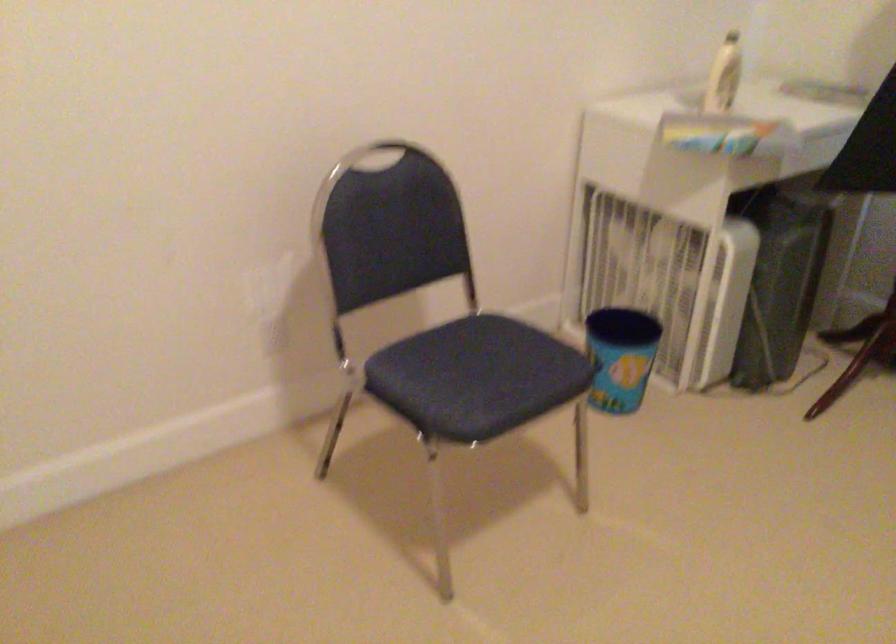
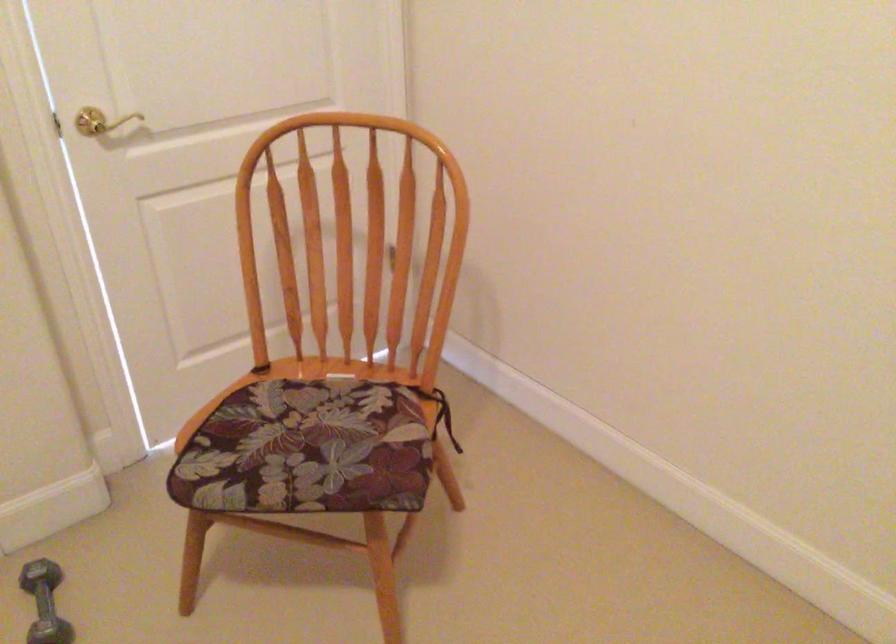
First-person continuous shooting, in which direction is the camera rotating?

The camera's rotation is toward left-down.